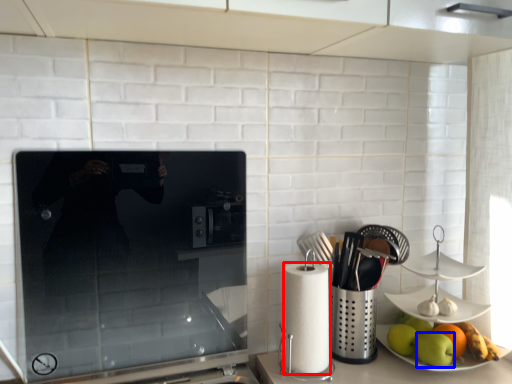
Question: Which object is further to the camera taking this photo, paper towel (highlighted by a red box) or apple (highlighted by a blue box)?

Choices:
 (A) paper towel
 (B) apple

Answer: (B)